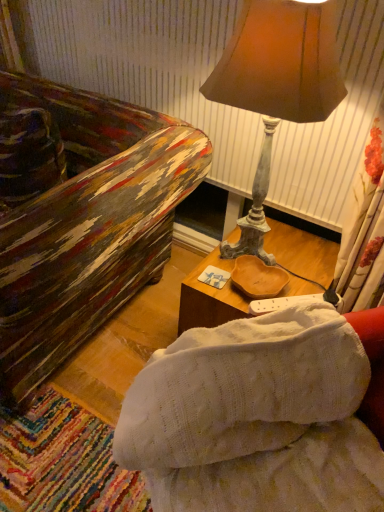
Question: From the image's perspective, does wooden tray at center appear lower than matte brown lampshade at upper right?

Choices:
 (A) no
 (B) yes

Answer: (B)

Question: Can you confirm if wooden tray at center is shorter than matte brown lampshade at upper right?

Choices:
 (A) no
 (B) yes

Answer: (B)

Question: Is wooden tray at center smaller than matte brown lampshade at upper right?

Choices:
 (A) yes
 (B) no

Answer: (A)

Question: Considering the relative sizes of wooden tray at center and matte brown lampshade at upper right in the image provided, is wooden tray at center bigger than matte brown lampshade at upper right?

Choices:
 (A) yes
 (B) no

Answer: (B)

Question: Is wooden tray at center at the left side of matte brown lampshade at upper right?

Choices:
 (A) no
 (B) yes

Answer: (A)

Question: Is wooden tray at center closer to camera compared to matte brown lampshade at upper right?

Choices:
 (A) yes
 (B) no

Answer: (B)

Question: Can you confirm if matte brown lampshade at upper right is taller than white knitted studio couch at center?

Choices:
 (A) no
 (B) yes

Answer: (B)

Question: Are matte brown lampshade at upper right and white knitted studio couch at center beside each other?

Choices:
 (A) yes
 (B) no

Answer: (B)

Question: Does matte brown lampshade at upper right have a smaller size compared to white knitted studio couch at center?

Choices:
 (A) yes
 (B) no

Answer: (A)

Question: Is matte brown lampshade at upper right at the right side of white knitted studio couch at center?

Choices:
 (A) yes
 (B) no

Answer: (A)

Question: Does matte brown lampshade at upper right have a larger size compared to white knitted studio couch at center?

Choices:
 (A) no
 (B) yes

Answer: (A)

Question: From the image's perspective, is matte brown lampshade at upper right beneath white knitted studio couch at center?

Choices:
 (A) no
 (B) yes

Answer: (A)

Question: Can you confirm if wooden tray at center is bigger than white knitted studio couch at center?

Choices:
 (A) no
 (B) yes

Answer: (A)